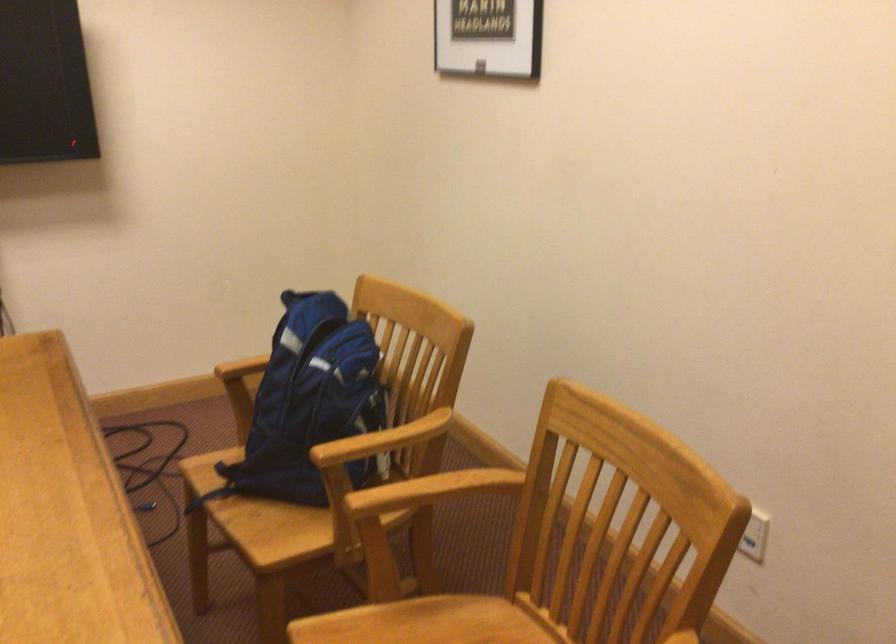
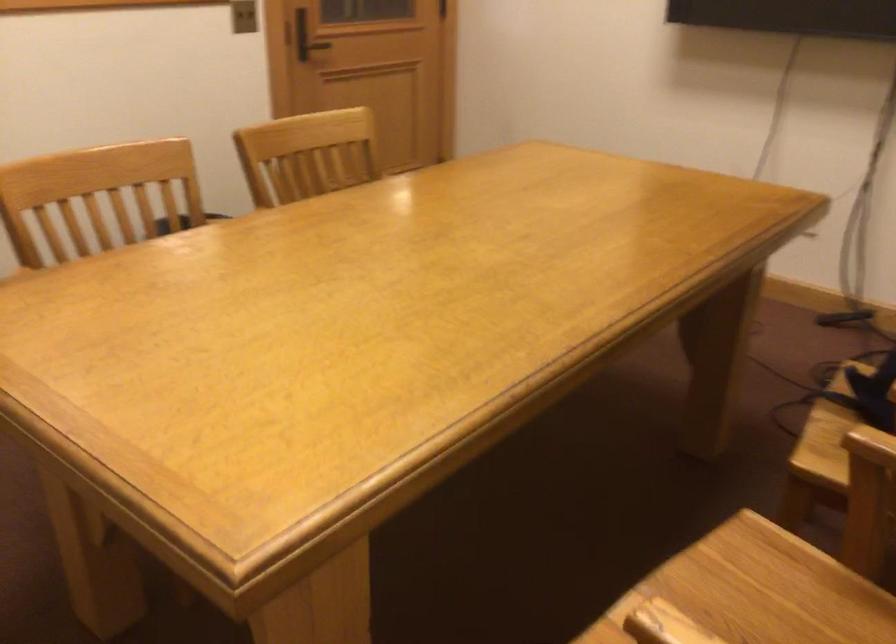
Find the pixel in the second image that matches the point at 233,516 in the first image.

(823, 419)